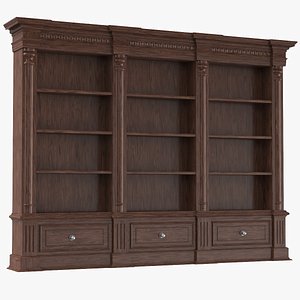
Locate an element on the screen. column is located at coordinates (26, 163), (117, 137), (204, 119), (277, 117).